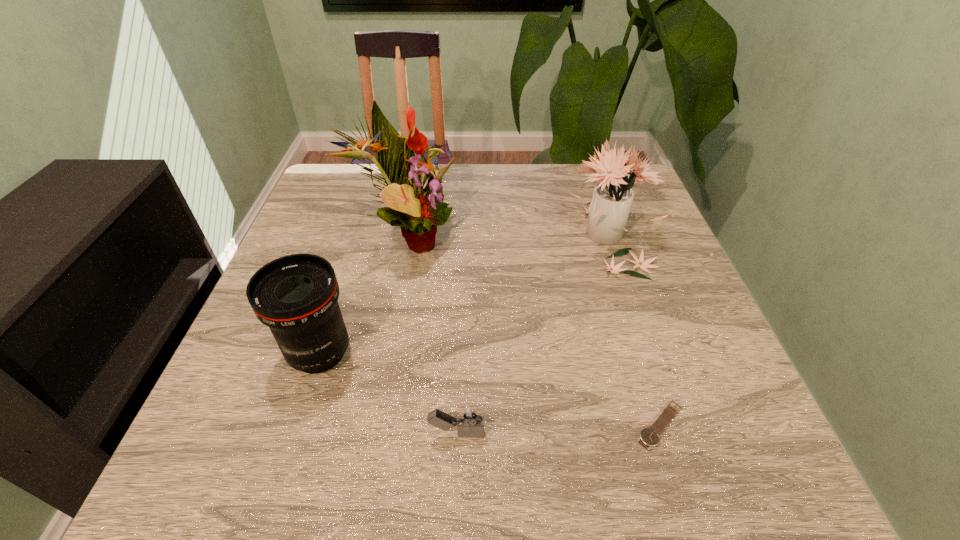
Identify the location of vacant region between the tallest object and the igniter. (432, 336).

At what (x,y) coordinates should I click in order to perform the action: click on free space that is in between the taller bouquet and the fourth shortest object. Please return your answer as a coordinate pair (x, y). Image resolution: width=960 pixels, height=540 pixels. Looking at the image, I should click on (508, 237).

Find the location of `free space between the tallest object and the second shortest object`. free space between the tallest object and the second shortest object is located at coordinates (432, 336).

What are the coordinates of `unoccupied area between the taller bouquet and the watch` in the screenshot? It's located at (534, 332).

You are a GUI agent. You are given a task and a screenshot of the screen. Output one action in this format:
    pyautogui.click(x=<x>, y=<y>)
    Task: Click on the free area in between the third tallest object and the fourth shortest object
    This screenshot has width=960, height=540.
    Given the screenshot: What is the action you would take?
    pyautogui.click(x=465, y=294)

Where is `unoccupied area between the watch and the left bouquet`? unoccupied area between the watch and the left bouquet is located at coordinates (534, 332).

The height and width of the screenshot is (540, 960). In order to click on object that is the second closest to the taller bouquet in this screenshot , I will do `click(609, 209)`.

At what (x,y) coordinates should I click in order to perform the action: click on object that stands as the fourth closest to the second tallest object. Please return your answer as a coordinate pair (x, y). Looking at the image, I should click on (296, 296).

Where is `vacant space that satisfies the following two spatial constraints: 1. on the back side of the shortest object; 2. on the right side of the fourth tallest object`? The width and height of the screenshot is (960, 540). vacant space that satisfies the following two spatial constraints: 1. on the back side of the shortest object; 2. on the right side of the fourth tallest object is located at coordinates (457, 424).

At what (x,y) coordinates should I click in order to perform the action: click on free region that satisfies the following two spatial constraints: 1. on the front-facing side of the tallest object; 2. on the front side of the third nearest object. Please return your answer as a coordinate pair (x, y). The image size is (960, 540). Looking at the image, I should click on (386, 353).